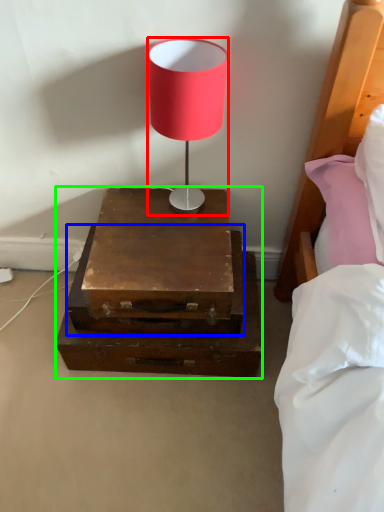
Question: Which object is positioned farthest from lamp (highlighted by a red box)? Select from drawer (highlighted by a blue box) and nightstand (highlighted by a green box).

Choices:
 (A) drawer
 (B) nightstand

Answer: (A)